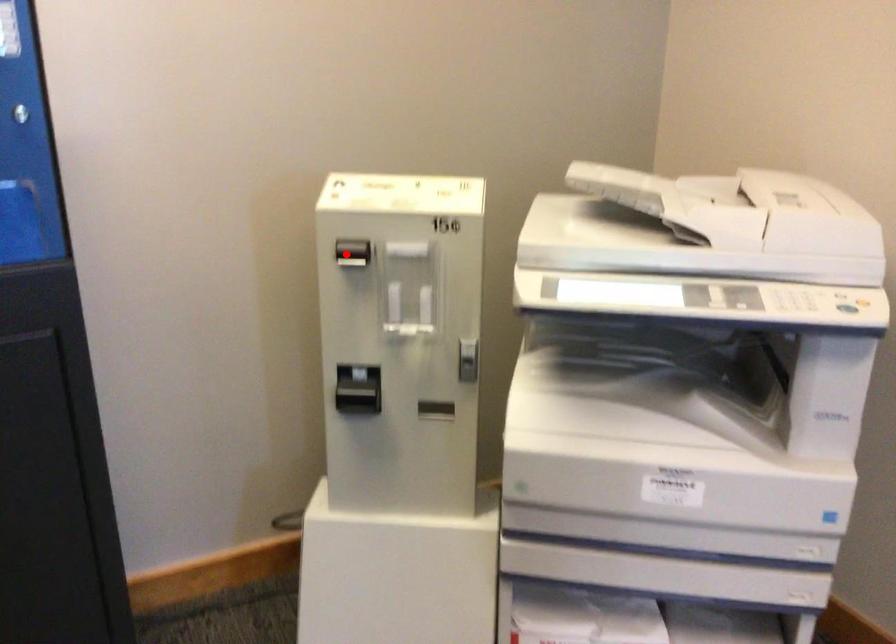
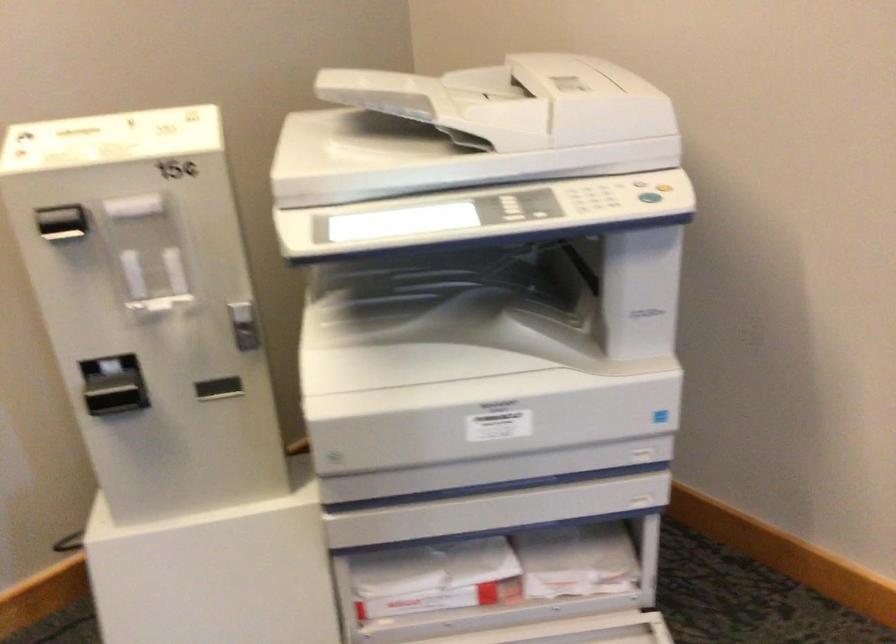
Find the pixel in the second image that matches the highlighted location in the first image.

(62, 223)